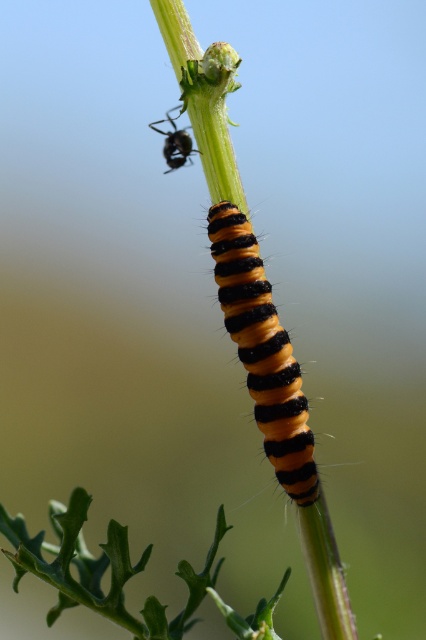
Is orange fuzzy caterpillar at center positioned behind shiny black ant at upper center?

No, it is not.

Between orange fuzzy caterpillar at center and shiny black ant at upper center, which one is positioned lower?

orange fuzzy caterpillar at center is lower down.

What do you see at coordinates (264, 353) in the screenshot? This screenshot has height=640, width=426. I see `orange fuzzy caterpillar at center` at bounding box center [264, 353].

This screenshot has height=640, width=426. What are the coordinates of `orange fuzzy caterpillar at center` in the screenshot? It's located at [264, 353].